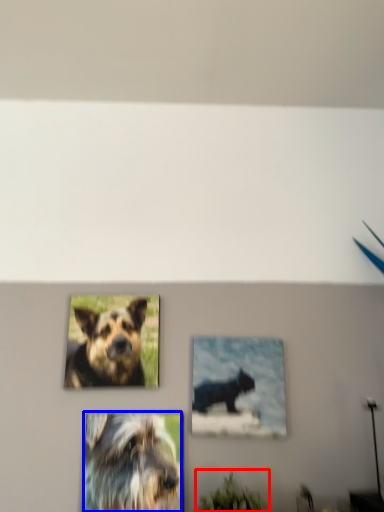
Question: Which of the following is the closest to the observer, plant (highlighted by a red box) or dog (highlighted by a blue box)?

Choices:
 (A) plant
 (B) dog

Answer: (A)